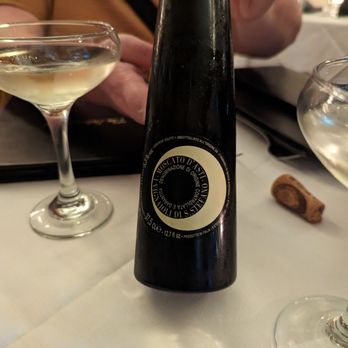
At what (x,y) coordinates should I click in order to perform the action: click on table. Please return your answer as a coordinate pair (x, y). Looking at the image, I should click on (278, 241).